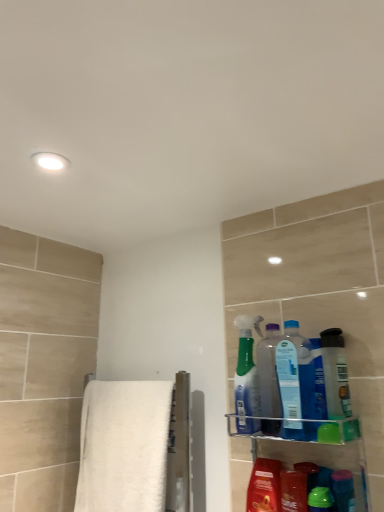
The image size is (384, 512). Describe the element at coordinates (269, 372) in the screenshot. I see `translucent plastic bottle at upper right, which ranks as the 4th cleaning product in right-to-left order` at that location.

Find the location of a particular element. This screenshot has height=512, width=384. translucent plastic bottle at upper right, the second cleaning product positioned from the left is located at coordinates (269, 372).

What do you see at coordinates (124, 446) in the screenshot? The image size is (384, 512). I see `white fluffy towel at left` at bounding box center [124, 446].

This screenshot has width=384, height=512. What do you see at coordinates (343, 490) in the screenshot?
I see `translucent plastic bottle at right` at bounding box center [343, 490].

This screenshot has width=384, height=512. Describe the element at coordinates (320, 500) in the screenshot. I see `green glossy bottle at lower right, which is counted as the second cleaning product, starting from the right` at that location.

This screenshot has width=384, height=512. In order to click on translucent plastic spray bottle at upper right, acting as the 5th cleaning product starting from the left in this screenshot , I will do `click(335, 374)`.

Describe the element at coordinates (264, 486) in the screenshot. I see `shiny plastic mouthwash at lower right` at that location.

I want to click on translucent plastic bottle at upper right, the second cleaning product positioned from the left, so click(x=269, y=372).

Is translucent green spray bottle at upper right, the fifth cleaning product viewed from the right, not close to translucent plastic spray bottle at upper right, the third cleaning product when ordered from left to right?

No, translucent green spray bottle at upper right, the fifth cleaning product viewed from the right, is in close proximity to translucent plastic spray bottle at upper right, the third cleaning product when ordered from left to right.

Considering the relative positions of translucent green spray bottle at upper right, the fifth cleaning product viewed from the right, and translucent plastic spray bottle at upper right, placed as the third cleaning product when sorted from right to left, in the image provided, is translucent green spray bottle at upper right, the fifth cleaning product viewed from the right, to the left or to the right of translucent plastic spray bottle at upper right, placed as the third cleaning product when sorted from right to left,?

From the image, it's evident that translucent green spray bottle at upper right, the fifth cleaning product viewed from the right, is to the left of translucent plastic spray bottle at upper right, placed as the third cleaning product when sorted from right to left.

From the image's perspective, which object appears higher, translucent green spray bottle at upper right, the fifth cleaning product viewed from the right, or translucent plastic spray bottle at upper right, placed as the third cleaning product when sorted from right to left?

From the image's view, translucent plastic spray bottle at upper right, placed as the third cleaning product when sorted from right to left, is above.

Find the location of a particular element. The image size is (384, 512). the 2nd cleaning product behind the translucent plastic spray bottle at upper right, the third cleaning product when ordered from left to right, starting your count from the anchor is located at coordinates pyautogui.click(x=246, y=378).

Find the location of a particular element. This screenshot has width=384, height=512. the 2nd cleaning product in front of the white fluffy towel at left, counting from the anchor's position is located at coordinates (269, 372).

Is point (112, 447) closer or farther from the camera than point (276, 404)?

Point (112, 447) is positioned farther from the camera compared to point (276, 404).

Is translucent plastic bottle at upper right, which ranks as the 4th cleaning product in right-to-left order, completely or partially inside white fluffy towel at left?

No, translucent plastic bottle at upper right, which ranks as the 4th cleaning product in right-to-left order, is located outside of white fluffy towel at left.

From a real-world perspective, is white fluffy towel at left above or below translucent plastic bottle at upper right, the second cleaning product positioned from the left?

Clearly, from a real-world perspective, white fluffy towel at left is below translucent plastic bottle at upper right, the second cleaning product positioned from the left.

Where is `cleaning product that is the 2nd one when counting forward from the translucent plastic spray bottle at upper right, the third cleaning product when ordered from left to right`? cleaning product that is the 2nd one when counting forward from the translucent plastic spray bottle at upper right, the third cleaning product when ordered from left to right is located at coordinates (320, 500).

Can you tell me how much green glossy bottle at lower right, which ranks as the 4th cleaning product in left-to-right order, and translucent plastic spray bottle at upper right, the third cleaning product when ordered from left to right, differ in facing direction?

The angular difference between green glossy bottle at lower right, which ranks as the 4th cleaning product in left-to-right order, and translucent plastic spray bottle at upper right, the third cleaning product when ordered from left to right, is 0.000655 degrees.

Would you say green glossy bottle at lower right, which is counted as the second cleaning product, starting from the right, is a long distance from translucent plastic spray bottle at upper right, placed as the third cleaning product when sorted from right to left?

They are positioned close to each other.

Does green glossy bottle at lower right, which ranks as the 4th cleaning product in left-to-right order, have a lesser width compared to translucent plastic spray bottle at upper right, the third cleaning product when ordered from left to right?

Yes.

Would you consider green glossy bottle at lower right, which is counted as the second cleaning product, starting from the right, to be distant from translucent plastic bottle at right?

No, green glossy bottle at lower right, which is counted as the second cleaning product, starting from the right, is not far away from translucent plastic bottle at right.

From a real-world perspective, is green glossy bottle at lower right, which ranks as the 4th cleaning product in left-to-right order, positioned under translucent plastic bottle at right based on gravity?

Yes.

Is green glossy bottle at lower right, which ranks as the 4th cleaning product in left-to-right order, bigger than translucent plastic bottle at right?

No, green glossy bottle at lower right, which ranks as the 4th cleaning product in left-to-right order, is not bigger than translucent plastic bottle at right.

Is green glossy bottle at lower right, which is counted as the second cleaning product, starting from the right, outside of translucent plastic bottle at right?

Yes, green glossy bottle at lower right, which is counted as the second cleaning product, starting from the right, is located beyond the bounds of translucent plastic bottle at right.

Is translucent plastic spray bottle at upper right, the third cleaning product when ordered from left to right, aimed at green glossy bottle at lower right, which ranks as the 4th cleaning product in left-to-right order?

No, translucent plastic spray bottle at upper right, the third cleaning product when ordered from left to right, is not facing towards green glossy bottle at lower right, which ranks as the 4th cleaning product in left-to-right order.

Can you tell me how much translucent plastic spray bottle at upper right, the third cleaning product when ordered from left to right, and green glossy bottle at lower right, which is counted as the second cleaning product, starting from the right, differ in facing direction?

0.000655 degrees separate the facing orientations of translucent plastic spray bottle at upper right, the third cleaning product when ordered from left to right, and green glossy bottle at lower right, which is counted as the second cleaning product, starting from the right.

From the image's perspective, is translucent plastic spray bottle at upper right, the third cleaning product when ordered from left to right, under green glossy bottle at lower right, which ranks as the 4th cleaning product in left-to-right order?

Incorrect, from the image's perspective, translucent plastic spray bottle at upper right, the third cleaning product when ordered from left to right, is higher than green glossy bottle at lower right, which ranks as the 4th cleaning product in left-to-right order.

Would you consider translucent plastic spray bottle at upper right, the third cleaning product when ordered from left to right, to be distant from green glossy bottle at lower right, which ranks as the 4th cleaning product in left-to-right order?

No, there isn't a large distance between translucent plastic spray bottle at upper right, the third cleaning product when ordered from left to right, and green glossy bottle at lower right, which ranks as the 4th cleaning product in left-to-right order.

Based on their sizes in the image, would you say green glossy bottle at lower right, which is counted as the second cleaning product, starting from the right, is bigger or smaller than white fluffy towel at left?

green glossy bottle at lower right, which is counted as the second cleaning product, starting from the right, is smaller than white fluffy towel at left.

Is green glossy bottle at lower right, which ranks as the 4th cleaning product in left-to-right order, further to camera compared to white fluffy towel at left?

No.

From the image's perspective, would you say green glossy bottle at lower right, which ranks as the 4th cleaning product in left-to-right order, is shown under white fluffy towel at left?

Indeed, from the image's perspective, green glossy bottle at lower right, which ranks as the 4th cleaning product in left-to-right order, is shown beneath white fluffy towel at left.

Is green glossy bottle at lower right, which ranks as the 4th cleaning product in left-to-right order, shorter than white fluffy towel at left?

Correct, green glossy bottle at lower right, which ranks as the 4th cleaning product in left-to-right order, is not as tall as white fluffy towel at left.

Does translucent plastic bottle at right have a smaller size compared to translucent plastic spray bottle at upper right, the third cleaning product when ordered from left to right?

Yes, translucent plastic bottle at right is smaller than translucent plastic spray bottle at upper right, the third cleaning product when ordered from left to right.

Who is shorter, translucent plastic bottle at right or translucent plastic spray bottle at upper right, placed as the third cleaning product when sorted from right to left?

Standing shorter between the two is translucent plastic bottle at right.

From the image's perspective, between translucent plastic bottle at right and translucent plastic spray bottle at upper right, placed as the third cleaning product when sorted from right to left, which one is located above?

translucent plastic spray bottle at upper right, placed as the third cleaning product when sorted from right to left, from the image's perspective.

Where is `the 2nd cleaning product to the left of the translucent plastic spray bottle at upper right, the third cleaning product when ordered from left to right, counting from the anchor's position`? the 2nd cleaning product to the left of the translucent plastic spray bottle at upper right, the third cleaning product when ordered from left to right, counting from the anchor's position is located at coordinates (246, 378).

Where is `towel that appears below the translucent plastic bottle at upper right, the second cleaning product positioned from the left (from the image's perspective)`? The image size is (384, 512). towel that appears below the translucent plastic bottle at upper right, the second cleaning product positioned from the left (from the image's perspective) is located at coordinates (124, 446).

In the scene shown: Looking at the image, which one is located closer to green glossy bottle at lower right, which ranks as the 4th cleaning product in left-to-right order, translucent plastic spray bottle at upper right, acting as the 5th cleaning product starting from the left, or translucent plastic bottle at upper right, the second cleaning product positioned from the left?

translucent plastic spray bottle at upper right, acting as the 5th cleaning product starting from the left, lies closer to green glossy bottle at lower right, which ranks as the 4th cleaning product in left-to-right order, than the other object.

Which object lies nearer to the anchor point green glossy bottle at lower right, which ranks as the 4th cleaning product in left-to-right order, translucent plastic bottle at right or clear plastic shelf at lower right?

translucent plastic bottle at right lies closer to green glossy bottle at lower right, which ranks as the 4th cleaning product in left-to-right order, than the other object.

Looking at the image, which one is located further to translucent plastic bottle at right, clear plastic shelf at lower right or shiny plastic mouthwash at lower right?

shiny plastic mouthwash at lower right is positioned further to the anchor translucent plastic bottle at right.

Which object lies further to the anchor point white fluffy towel at left, translucent plastic bottle at right or translucent plastic bottle at upper right, which ranks as the 4th cleaning product in right-to-left order?

Among the two, translucent plastic bottle at right is located further to white fluffy towel at left.

From the image, which object appears to be farther from translucent green spray bottle at upper right, the 1th cleaning product viewed from the left, translucent plastic spray bottle at upper right, the third cleaning product when ordered from left to right, or green glossy bottle at lower right, which is counted as the second cleaning product, starting from the right?

The object further to translucent green spray bottle at upper right, the 1th cleaning product viewed from the left, is green glossy bottle at lower right, which is counted as the second cleaning product, starting from the right.

From the image, which object appears to be nearer to shiny plastic mouthwash at lower right, translucent plastic bottle at right or translucent plastic spray bottle at upper right, placed as the third cleaning product when sorted from right to left?

translucent plastic bottle at right lies closer to shiny plastic mouthwash at lower right than the other object.

From the image, which object appears to be nearer to green glossy bottle at lower right, which ranks as the 4th cleaning product in left-to-right order, white fluffy towel at left or translucent green spray bottle at upper right, the 1th cleaning product viewed from the left?

Among the two, translucent green spray bottle at upper right, the 1th cleaning product viewed from the left, is located nearer to green glossy bottle at lower right, which ranks as the 4th cleaning product in left-to-right order.

Based on their spatial positions, is green glossy bottle at lower right, which ranks as the 4th cleaning product in left-to-right order, or clear plastic shelf at lower right further from translucent plastic spray bottle at upper right, the third cleaning product when ordered from left to right?

The object further to translucent plastic spray bottle at upper right, the third cleaning product when ordered from left to right, is green glossy bottle at lower right, which ranks as the 4th cleaning product in left-to-right order.

The height and width of the screenshot is (512, 384). What are the coordinates of `toiletry between translucent plastic spray bottle at upper right, acting as the 5th cleaning product starting from the left, and shiny plastic mouthwash at lower right, in the vertical direction` in the screenshot? It's located at (343, 490).

This screenshot has width=384, height=512. In order to click on shelf between shiny plastic mouthwash at lower right and translucent plastic bottle at right in this screenshot , I will do `click(318, 456)`.

At what (x,y) coordinates should I click in order to perform the action: click on mouthwash between white fluffy towel at left and translucent plastic spray bottle at upper right, the third cleaning product when ordered from left to right, from left to right. Please return your answer as a coordinate pair (x, y). Image resolution: width=384 pixels, height=512 pixels. Looking at the image, I should click on (264, 486).

Image resolution: width=384 pixels, height=512 pixels. What are the coordinates of `shelf between translucent green spray bottle at upper right, the fifth cleaning product viewed from the right, and green glossy bottle at lower right, which is counted as the second cleaning product, starting from the right, in the vertical direction` in the screenshot? It's located at (318, 456).